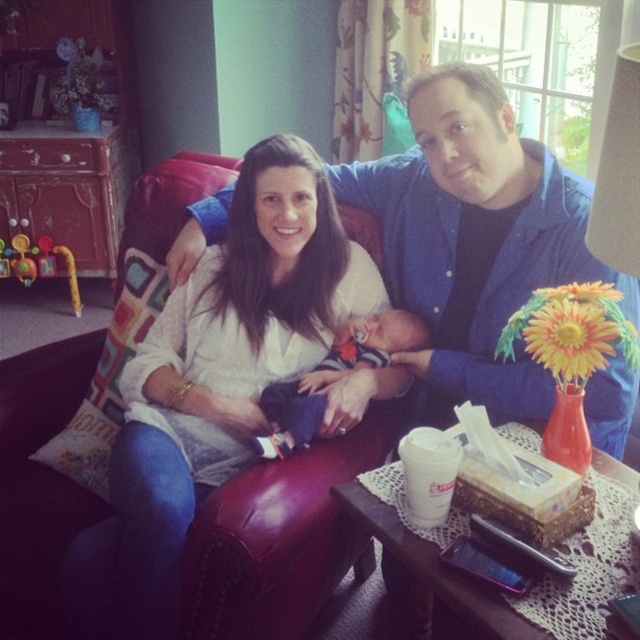
You are a photographer taking a picture of the scene. You need to adjust the lighting so that the white soft fabric at center and the soft blue fabric newborn at center are both well lit. Which object should you place a reflector to the right of to ensure proper lighting?

You should place the reflector to the right of the white soft fabric at center because it is to the left of the soft blue fabric newborn at center, so directing light towards the left side will help illuminate both objects effectively.

You are a tailor who needs to determine which fabric piece is wider between the white soft fabric at center and the soft blue fabric newborn at center. Which one is wider?

The white soft fabric at center might be wider than the soft blue fabric newborn at center.